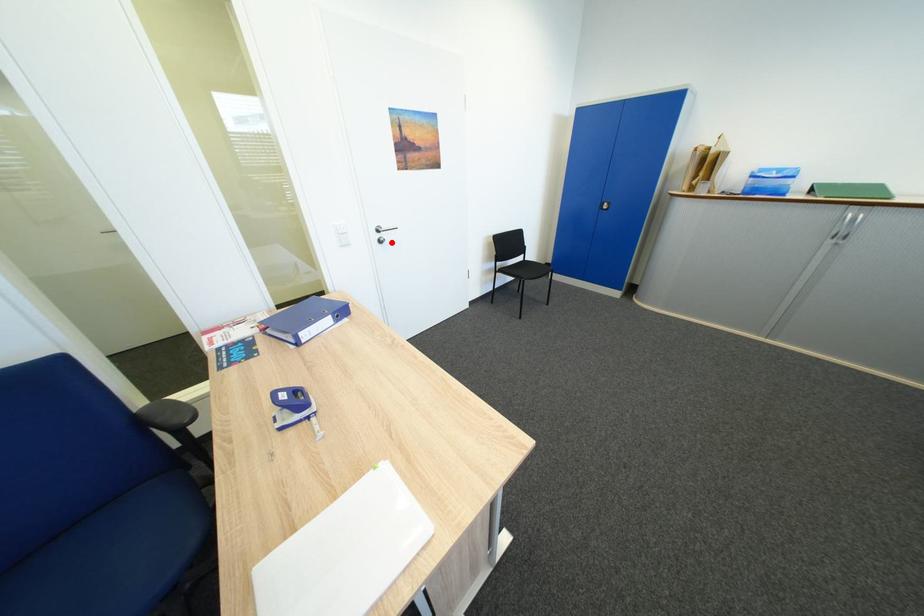
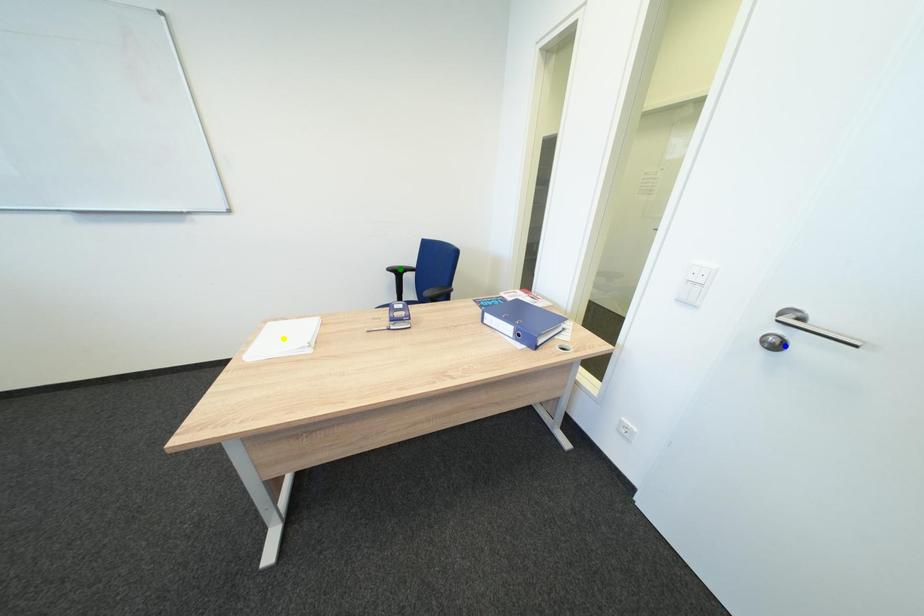
Question: I am providing you with two images of the same scene from different viewpoints. A red point is marked on the first image. You are given multiple points on the second image. Which spot in image 2 lines up with the point in image 1?

Choices:
 (A) green point
 (B) blue point
 (C) yellow point

Answer: (B)